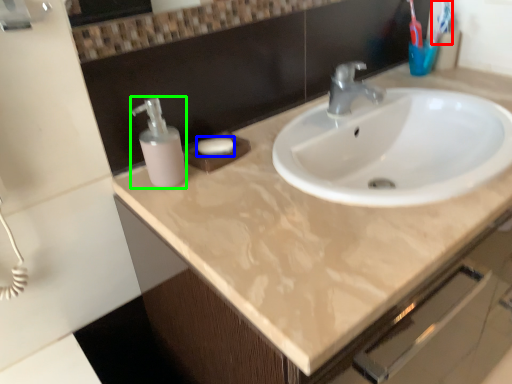
Question: Estimate the real-world distances between objects in this image. Which object is closer to toothbrush (highlighted by a red box), soap (highlighted by a blue box) or soap dispenser (highlighted by a green box)?

Choices:
 (A) soap
 (B) soap dispenser

Answer: (A)